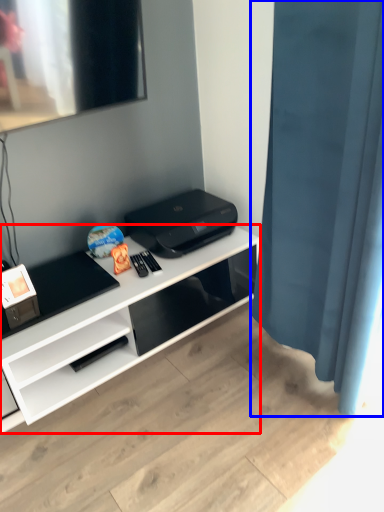
Question: Which object is closer to the camera taking this photo, desk (highlighted by a red box) or shower curtain (highlighted by a blue box)?

Choices:
 (A) desk
 (B) shower curtain

Answer: (B)